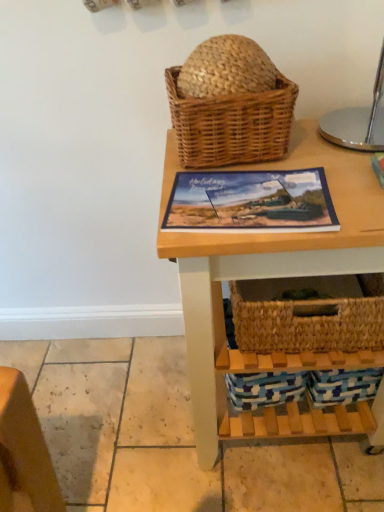
You are a GUI agent. You are given a task and a screenshot of the screen. Output one action in this format:
    pyautogui.click(x=<x>, y=<y>)
    Task: Click on the free region on the left part of natural wood table at center
    
    Given the screenshot: What is the action you would take?
    pyautogui.click(x=129, y=412)